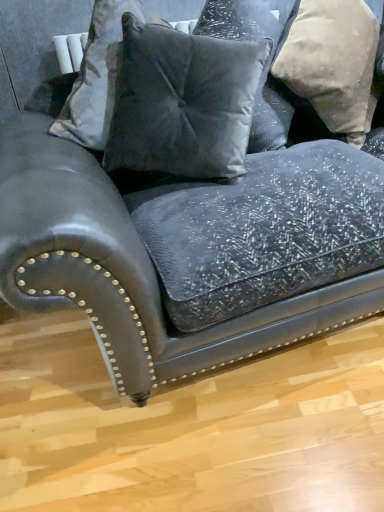
In order to face velvet gray pillow at upper center, placed as the second pillow when sorted from left to right, should I rotate leftwards or rightwards?

It's best to rotate right around 6.283 degrees.

In order to click on beige textured pillow at upper right, the third pillow positioned from the left in this screenshot , I will do (x=333, y=61).

This screenshot has width=384, height=512. In order to click on velvet gray pillow at upper center, placed as the second pillow when sorted from left to right in this screenshot , I will do `click(265, 63)`.

What's the angular difference between velvet gray pillow at center, which is counted as the 3th pillow, starting from the right, and beige textured pillow at upper right, the third pillow positioned from the left,'s facing directions?

The facing directions of velvet gray pillow at center, which is counted as the 3th pillow, starting from the right, and beige textured pillow at upper right, the third pillow positioned from the left, are 0.000474 degrees apart.

Is velvet gray pillow at center, which is counted as the 3th pillow, starting from the right, oriented away from beige textured pillow at upper right, the third pillow positioned from the left?

No, velvet gray pillow at center, which is counted as the 3th pillow, starting from the right, is not facing away from beige textured pillow at upper right, the third pillow positioned from the left.

From the image's perspective, is velvet gray pillow at center, which is counted as the 3th pillow, starting from the right, below beige textured pillow at upper right, the third pillow positioned from the left?

Yes.

Considering the sizes of velvet gray pillow at center, which is counted as the 3th pillow, starting from the right, and beige textured pillow at upper right, the third pillow positioned from the left, in the image, is velvet gray pillow at center, which is counted as the 3th pillow, starting from the right, bigger or smaller than beige textured pillow at upper right, the third pillow positioned from the left,?

velvet gray pillow at center, which is counted as the 3th pillow, starting from the right, is smaller than beige textured pillow at upper right, the third pillow positioned from the left.

From the image's perspective, is beige textured pillow at upper right, positioned as the first pillow in right-to-left order, on top of velvet gray pillow at center, which is counted as the 3th pillow, starting from the right?

Yes, from the image's perspective, beige textured pillow at upper right, positioned as the first pillow in right-to-left order, is on top of velvet gray pillow at center, which is counted as the 3th pillow, starting from the right.

Is beige textured pillow at upper right, the third pillow positioned from the left, facing towards velvet gray pillow at center, which is counted as the 3th pillow, starting from the right?

No, beige textured pillow at upper right, the third pillow positioned from the left, is not turned towards velvet gray pillow at center, which is counted as the 3th pillow, starting from the right.

Locate an element on the screen. the 2nd pillow in front of the beige textured pillow at upper right, positioned as the first pillow in right-to-left order, counting from the anchor's position is located at coordinates (182, 102).

How much distance is there between velvet gray pillow at upper center, placed as the second pillow when sorted from left to right, and velvet gray pillow at center, which is counted as the 3th pillow, starting from the right?

They are 9.63 inches apart.

From the picture: Is velvet gray pillow at upper center, which is the 2th pillow from right to left, positioned beyond the bounds of velvet gray pillow at center, which is counted as the 3th pillow, starting from the right?

velvet gray pillow at upper center, which is the 2th pillow from right to left, lies outside velvet gray pillow at center, which is counted as the 3th pillow, starting from the right,'s area.

Is point (279, 135) closer or farther from the camera than point (133, 82)?

Point (279, 135) is farther from the camera than point (133, 82).

Looking at this image, in terms of size, does velvet gray pillow at upper center, which is the 2th pillow from right to left, appear bigger or smaller than velvet gray pillow at center, the first pillow positioned from the left?

velvet gray pillow at upper center, which is the 2th pillow from right to left, is bigger than velvet gray pillow at center, the first pillow positioned from the left.

Is the position of beige textured pillow at upper right, the third pillow positioned from the left, less distant than that of velvet gray pillow at upper center, placed as the second pillow when sorted from left to right?

That is False.

Is beige textured pillow at upper right, positioned as the first pillow in right-to-left order, touching velvet gray pillow at upper center, which is the 2th pillow from right to left?

No, beige textured pillow at upper right, positioned as the first pillow in right-to-left order, is not beside velvet gray pillow at upper center, which is the 2th pillow from right to left.

Is velvet gray pillow at upper center, which is the 2th pillow from right to left, at the back of beige textured pillow at upper right, positioned as the first pillow in right-to-left order?

That's not correct — beige textured pillow at upper right, positioned as the first pillow in right-to-left order, is not looking away from velvet gray pillow at upper center, which is the 2th pillow from right to left.

Based on the photo, would you say velvet gray pillow at center, the first pillow positioned from the left, is to the left or to the right of velvet gray pillow at upper center, placed as the second pillow when sorted from left to right, in the picture?

velvet gray pillow at center, the first pillow positioned from the left, is to the left of velvet gray pillow at upper center, placed as the second pillow when sorted from left to right.

Is velvet gray pillow at center, the first pillow positioned from the left, facing away from velvet gray pillow at upper center, placed as the second pillow when sorted from left to right?

Correct, velvet gray pillow at center, the first pillow positioned from the left, is looking away from velvet gray pillow at upper center, placed as the second pillow when sorted from left to right.

Considering the relative sizes of velvet gray pillow at center, which is counted as the 3th pillow, starting from the right, and velvet gray pillow at upper center, placed as the second pillow when sorted from left to right, in the image provided, is velvet gray pillow at center, which is counted as the 3th pillow, starting from the right, smaller than velvet gray pillow at upper center, placed as the second pillow when sorted from left to right,?

Yes.

Does point (185, 68) come farther from viewer compared to point (250, 143)?

No, (185, 68) is closer to viewer.

Between velvet gray pillow at upper center, placed as the second pillow when sorted from left to right, and beige textured pillow at upper right, positioned as the first pillow in right-to-left order, which one is positioned in front?

velvet gray pillow at upper center, placed as the second pillow when sorted from left to right, is closer to the camera.

Do you think velvet gray pillow at upper center, placed as the second pillow when sorted from left to right, is within beige textured pillow at upper right, positioned as the first pillow in right-to-left order, or outside of it?

velvet gray pillow at upper center, placed as the second pillow when sorted from left to right, exists outside the volume of beige textured pillow at upper right, positioned as the first pillow in right-to-left order.

Considering the relative sizes of velvet gray pillow at upper center, which is the 2th pillow from right to left, and beige textured pillow at upper right, the third pillow positioned from the left, in the image provided, is velvet gray pillow at upper center, which is the 2th pillow from right to left, thinner than beige textured pillow at upper right, the third pillow positioned from the left,?

Yes, velvet gray pillow at upper center, which is the 2th pillow from right to left, is thinner than beige textured pillow at upper right, the third pillow positioned from the left.

Which is in front, point (239, 16) or point (303, 57)?

The point (303, 57) is in front.

The height and width of the screenshot is (512, 384). What are the coordinates of `the 2nd pillow above the beige textured pillow at upper right, the third pillow positioned from the left (from a real-world perspective)` in the screenshot? It's located at (182, 102).

Identify the location of the 2nd pillow in front of the beige textured pillow at upper right, positioned as the first pillow in right-to-left order. The image size is (384, 512). (182, 102).

From the image, which object appears to be farther from velvet gray pillow at center, which is counted as the 3th pillow, starting from the right, beige textured pillow at upper right, the third pillow positioned from the left, or velvet gray pillow at upper center, placed as the second pillow when sorted from left to right?

Among the two, beige textured pillow at upper right, the third pillow positioned from the left, is located further to velvet gray pillow at center, which is counted as the 3th pillow, starting from the right.

From the image, which object appears to be nearer to beige textured pillow at upper right, positioned as the first pillow in right-to-left order, velvet gray pillow at center, which is counted as the 3th pillow, starting from the right, or velvet gray pillow at upper center, which is the 2th pillow from right to left?

velvet gray pillow at upper center, which is the 2th pillow from right to left, is closer to beige textured pillow at upper right, positioned as the first pillow in right-to-left order.

Based on their spatial positions, is velvet gray pillow at upper center, placed as the second pillow when sorted from left to right, or beige textured pillow at upper right, positioned as the first pillow in right-to-left order, closer to velvet gray pillow at center, the first pillow positioned from the left?

velvet gray pillow at upper center, placed as the second pillow when sorted from left to right, is closer to velvet gray pillow at center, the first pillow positioned from the left.

Based on their spatial positions, is beige textured pillow at upper right, the third pillow positioned from the left, or velvet gray pillow at center, which is counted as the 3th pillow, starting from the right, further from velvet gray pillow at upper center, placed as the second pillow when sorted from left to right?

Among the two, velvet gray pillow at center, which is counted as the 3th pillow, starting from the right, is located further to velvet gray pillow at upper center, placed as the second pillow when sorted from left to right.

When comparing their distances from velvet gray pillow at upper center, which is the 2th pillow from right to left, does velvet gray pillow at center, which is counted as the 3th pillow, starting from the right, or beige textured pillow at upper right, the third pillow positioned from the left, seem closer?

Based on the image, beige textured pillow at upper right, the third pillow positioned from the left, appears to be nearer to velvet gray pillow at upper center, which is the 2th pillow from right to left.

Estimate the real-world distances between objects in this image. Which object is closer to beige textured pillow at upper right, the third pillow positioned from the left, velvet gray pillow at upper center, placed as the second pillow when sorted from left to right, or velvet gray pillow at center, which is counted as the 3th pillow, starting from the right?

Based on the image, velvet gray pillow at upper center, placed as the second pillow when sorted from left to right, appears to be nearer to beige textured pillow at upper right, the third pillow positioned from the left.

Where is `pillow between velvet gray pillow at center, the first pillow positioned from the left, and beige textured pillow at upper right, the third pillow positioned from the left`? This screenshot has width=384, height=512. pillow between velvet gray pillow at center, the first pillow positioned from the left, and beige textured pillow at upper right, the third pillow positioned from the left is located at coordinates (265, 63).